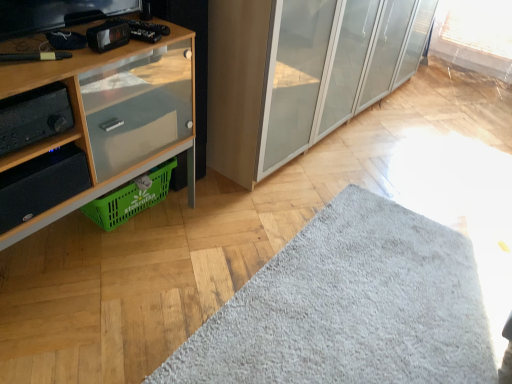
This screenshot has height=384, width=512. Describe the element at coordinates (34, 116) in the screenshot. I see `black matte stereo at left` at that location.

Locate an element on the screen. This screenshot has height=384, width=512. transparent glass cabinet at center is located at coordinates pyautogui.click(x=310, y=77).

Describe the element at coordinates (41, 185) in the screenshot. I see `black matte speaker at lower left` at that location.

Image resolution: width=512 pixels, height=384 pixels. In order to click on black matte stereo at left in this screenshot , I will do `click(34, 116)`.

Does gray fluffy mat at lower center have a smaller size compared to black matte stereo at left?

Actually, gray fluffy mat at lower center might be larger than black matte stereo at left.

Which of these two, gray fluffy mat at lower center or black matte stereo at left, is wider?

gray fluffy mat at lower center is wider.

From the image's perspective, between gray fluffy mat at lower center and black matte stereo at left, which one is located above?

black matte stereo at left is shown above in the image.

Is gray fluffy mat at lower center situated inside black matte stereo at left or outside?

gray fluffy mat at lower center is spatially situated outside black matte stereo at left.

Is green plastic basket at lower left smaller than black matte speaker at lower left?

No, green plastic basket at lower left is not smaller than black matte speaker at lower left.

Is green plastic basket at lower left not near black matte speaker at lower left?

No, there isn't a large distance between green plastic basket at lower left and black matte speaker at lower left.

From the image's perspective, between green plastic basket at lower left and black matte speaker at lower left, which one is located above?

green plastic basket at lower left is shown above in the image.

Is green plastic basket at lower left thinner than black matte speaker at lower left?

Incorrect, the width of green plastic basket at lower left is not less than that of black matte speaker at lower left.

Looking at their sizes, would you say transparent glass cabinet at center is wider or thinner than black matte speaker at lower left?

Clearly, transparent glass cabinet at center has more width compared to black matte speaker at lower left.

Identify the location of cabinetry below the black matte speaker at lower left (from a real-world perspective). This screenshot has height=384, width=512. (310, 77).

Between point (325, 25) and point (24, 190), which one is positioned behind?

Positioned behind is point (325, 25).

Is transparent glass cabinet at center with black matte speaker at lower left?

No, transparent glass cabinet at center is not with black matte speaker at lower left.

What's the angular difference between gray fluffy mat at lower center and wooden cabinet at left's facing directions?

They differ by 178 degrees in their facing directions.

The image size is (512, 384). Identify the location of cupboard above the gray fluffy mat at lower center (from the image's perspective). pos(112,114).

Does gray fluffy mat at lower center lie behind wooden cabinet at left?

No, gray fluffy mat at lower center is closer to the camera.

Is gray fluffy mat at lower center oriented away from wooden cabinet at left?

No, gray fluffy mat at lower center is not facing away from wooden cabinet at left.

Considering the relative positions of black matte speaker at lower left and black matte stereo at left in the image provided, is black matte speaker at lower left in front of black matte stereo at left?

No, black matte speaker at lower left is further to the viewer.

Which of these two, black matte speaker at lower left or black matte stereo at left, stands shorter?

black matte stereo at left.

This screenshot has width=512, height=384. What are the coordinates of `stereo above the black matte speaker at lower left (from the image's perspective)` in the screenshot? It's located at (34, 116).

Does point (145, 162) lie behind point (62, 185)?

Yes, it is behind point (62, 185).

Is there a large distance between wooden cabinet at left and black matte speaker at lower left?

No, there isn't a large distance between wooden cabinet at left and black matte speaker at lower left.

From the picture: From the image's perspective, which one is positioned higher, wooden cabinet at left or black matte speaker at lower left?

wooden cabinet at left is shown above in the image.

Which of these two, wooden cabinet at left or black matte speaker at lower left, stands taller?

With more height is wooden cabinet at left.

Can you confirm if wooden cabinet at left is shorter than green plastic basket at lower left?

No.

From a real-world perspective, between wooden cabinet at left and green plastic basket at lower left, who is vertically lower?

In real-world perspective, green plastic basket at lower left is lower.

Where is `cupboard that is above the green plastic basket at lower left (from the image's perspective)`? The height and width of the screenshot is (384, 512). cupboard that is above the green plastic basket at lower left (from the image's perspective) is located at coordinates (112, 114).

Based on the photo, is the position of wooden cabinet at left less distant than that of green plastic basket at lower left?

Yes, the depth of wooden cabinet at left is less than that of green plastic basket at lower left.

Find the location of `mat on the right of black matte stereo at left`. mat on the right of black matte stereo at left is located at coordinates (350, 307).

Locate an element on the screen. This screenshot has width=512, height=384. shelf in front of the green plastic basket at lower left is located at coordinates (41, 185).

Based on their spatial positions, is black matte stereo at left or wooden cabinet at left closer to gray fluffy mat at lower center?

wooden cabinet at left lies closer to gray fluffy mat at lower center than the other object.

Based on their spatial positions, is black matte speaker at lower left or gray fluffy mat at lower center further from transparent glass cabinet at center?

black matte speaker at lower left lies further to transparent glass cabinet at center than the other object.

Looking at the image, which one is located closer to wooden cabinet at left, gray fluffy mat at lower center or green plastic basket at lower left?

green plastic basket at lower left lies closer to wooden cabinet at left than the other object.

When comparing their distances from transparent glass cabinet at center, does gray fluffy mat at lower center or green plastic basket at lower left seem further?

gray fluffy mat at lower center is further to transparent glass cabinet at center.

Based on their spatial positions, is green plastic basket at lower left or gray fluffy mat at lower center further from transparent glass cabinet at center?

gray fluffy mat at lower center lies further to transparent glass cabinet at center than the other object.

Based on the photo, looking at the image, which one is located closer to transparent glass cabinet at center, black matte stereo at left or black matte speaker at lower left?

Among the two, black matte speaker at lower left is located nearer to transparent glass cabinet at center.

Considering their positions, is black matte speaker at lower left positioned further to gray fluffy mat at lower center than transparent glass cabinet at center?

black matte speaker at lower left is further to gray fluffy mat at lower center.

Estimate the real-world distances between objects in this image. Which object is closer to black matte stereo at left, green plastic basket at lower left or black matte speaker at lower left?

black matte speaker at lower left.

You are a GUI agent. You are given a task and a screenshot of the screen. Output one action in this format:
    pyautogui.click(x=<x>, y=<y>)
    Task: Click on the cabinetry between wooden cabinet at left and gray fluffy mat at lower center in the horizontal direction
    This screenshot has width=512, height=384.
    Given the screenshot: What is the action you would take?
    pyautogui.click(x=310, y=77)

You are a GUI agent. You are given a task and a screenshot of the screen. Output one action in this format:
    pyautogui.click(x=<x>, y=<y>)
    Task: Click on the basket between black matte stereo at left and transparent glass cabinet at center
    Image resolution: width=512 pixels, height=384 pixels.
    Given the screenshot: What is the action you would take?
    click(131, 197)

Find the location of `stereo between wooden cabinet at left and black matte speaker at lower left from front to back`. stereo between wooden cabinet at left and black matte speaker at lower left from front to back is located at coordinates (34, 116).

Locate an element on the screen. basket located between black matte speaker at lower left and transparent glass cabinet at center in the left-right direction is located at coordinates (131, 197).